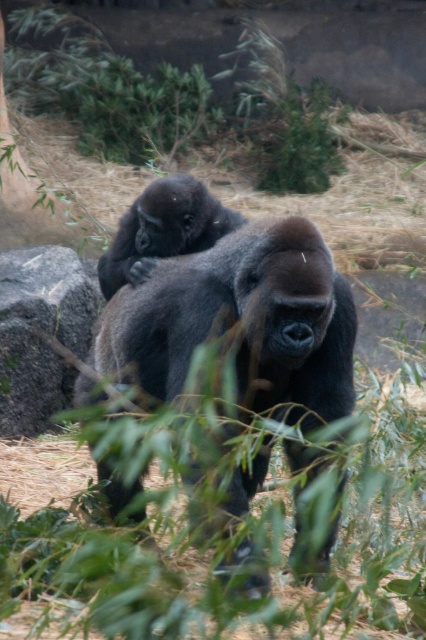
Question: Which of the following is the closest to the observer?

Choices:
 (A) (89, 620)
 (B) (420, 202)

Answer: (A)

Question: Where is green leafy grass at center located in relation to brown grass at center in the image?

Choices:
 (A) above
 (B) below

Answer: (B)

Question: Which object is the closest to the brown grass at center?

Choices:
 (A) green leafy grass at center
 (B) dark gray fur at center
 (C) gray rock at left
 (D) dark brown fur at center

Answer: (C)

Question: Does green leafy grass at center appear on the right side of gray rock at left?

Choices:
 (A) no
 (B) yes

Answer: (B)

Question: Can you confirm if brown grass at center is thinner than gray rock at left?

Choices:
 (A) no
 (B) yes

Answer: (A)

Question: Which of the following is the farthest from the observer?

Choices:
 (A) (40, 285)
 (B) (120, 269)
 (C) (371, 390)

Answer: (A)